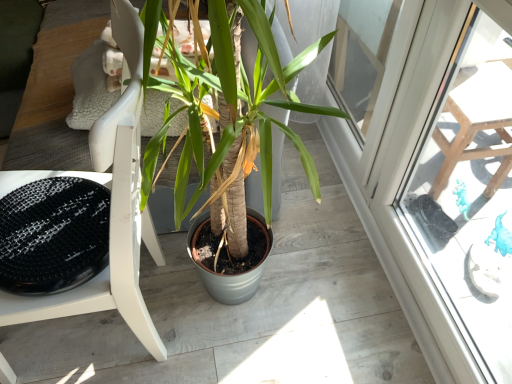
Question: From their relative heights in the image, would you say green matte plant at center is taller or shorter than white matte chair at center?

Choices:
 (A) short
 (B) tall

Answer: (A)

Question: In the image, is green matte plant at center positioned in front of or behind white matte chair at center?

Choices:
 (A) behind
 (B) front

Answer: (A)

Question: Considering the positions of point (261, 162) and point (139, 339), is point (261, 162) closer or farther from the camera than point (139, 339)?

Choices:
 (A) farther
 (B) closer

Answer: (A)

Question: From the image's perspective, is white matte chair at center positioned above or below green matte plant at center?

Choices:
 (A) below
 (B) above

Answer: (A)

Question: From their relative heights in the image, would you say white matte chair at center is taller or shorter than green matte plant at center?

Choices:
 (A) short
 (B) tall

Answer: (B)

Question: Considering the positions of white matte chair at center and green matte plant at center in the image, is white matte chair at center wider or thinner than green matte plant at center?

Choices:
 (A) thin
 (B) wide

Answer: (A)

Question: In the image, is white matte chair at center on the left side or the right side of green matte plant at center?

Choices:
 (A) right
 (B) left

Answer: (A)